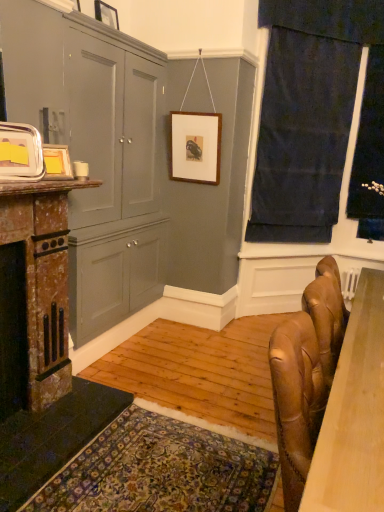
Locate an element on the screen. The height and width of the screenshot is (512, 384). matte yellow picture frame at left, the 2th picture frame in the front-to-back sequence is located at coordinates (57, 162).

Find the location of a particular element. dark blue fabric at upper right is located at coordinates (317, 118).

Measure the distance between dark blue fabric at upper right and camera.

dark blue fabric at upper right is 3.27 meters from camera.

What do you see at coordinates (196, 147) in the screenshot? I see `wooden picture frame at center, the fourth picture frame viewed from the left` at bounding box center [196, 147].

How much space does metallic silver picture frame at upper left, which is counted as the 4th picture frame, starting from the back, occupy vertically?

The height of metallic silver picture frame at upper left, which is counted as the 4th picture frame, starting from the back, is 9.96 inches.

Describe the element at coordinates (34, 294) in the screenshot. Image resolution: width=384 pixels, height=512 pixels. I see `rustic stone fireplace at left` at that location.

The image size is (384, 512). What do you see at coordinates (106, 14) in the screenshot? I see `wooden picture frame at upper center, which is counted as the 1th picture frame, starting from the top` at bounding box center [106, 14].

Locate an element on the screen. This screenshot has width=384, height=512. matte yellow picture frame at left, the second picture frame from the left is located at coordinates (57, 162).

In the image, is rustic stone fireplace at left on the left side or the right side of matte yellow picture frame at left, which ranks as the second picture frame in bottom-to-top order?

Clearly, rustic stone fireplace at left is on the left of matte yellow picture frame at left, which ranks as the second picture frame in bottom-to-top order, in the image.

From the image's perspective, between rustic stone fireplace at left and matte yellow picture frame at left, the third picture frame positioned from the top, who is located below?

rustic stone fireplace at left appears lower in the image.

Which object is thinner, rustic stone fireplace at left or matte yellow picture frame at left, the third picture frame when ordered from back to front?

matte yellow picture frame at left, the third picture frame when ordered from back to front, is thinner.

Does point (44, 328) come farther from viewer compared to point (56, 166)?

Yes.

Can you confirm if black velvet curtain at right is positioned to the left of matte yellow picture frame at left, the third picture frame when ordered from back to front?

No, black velvet curtain at right is not to the left of matte yellow picture frame at left, the third picture frame when ordered from back to front.

Is black velvet curtain at right spatially inside matte yellow picture frame at left, marked as the third picture frame in a right-to-left arrangement, or outside of it?

black velvet curtain at right lies outside matte yellow picture frame at left, marked as the third picture frame in a right-to-left arrangement.

Which object is closer to the camera taking this photo, black velvet curtain at right or matte yellow picture frame at left, the third picture frame when ordered from back to front?

matte yellow picture frame at left, the third picture frame when ordered from back to front.

From the image's perspective, who appears lower, wooden picture frame at upper center, which is counted as the third picture frame, starting from the front, or smooth brown leather table at lower right?

From the image's view, smooth brown leather table at lower right is below.

Is wooden picture frame at upper center, which is counted as the third picture frame, starting from the front, placed right next to smooth brown leather table at lower right?

No, wooden picture frame at upper center, which is counted as the third picture frame, starting from the front, is not with smooth brown leather table at lower right.

Find the location of `table that is under the wooden picture frame at upper center, the second picture frame when ordered from back to front (from a real-world perspective)`. table that is under the wooden picture frame at upper center, the second picture frame when ordered from back to front (from a real-world perspective) is located at coordinates (354, 414).

Based on the photo, how many degrees apart are the facing directions of black velvet curtain at right and smooth brown leather table at lower right?

The facing directions of black velvet curtain at right and smooth brown leather table at lower right are 90.4 degrees apart.

Based on the photo, is black velvet curtain at right in front of or behind smooth brown leather table at lower right in the image?

black velvet curtain at right is behind smooth brown leather table at lower right.

Where is `table on the left of the black velvet curtain at right`? table on the left of the black velvet curtain at right is located at coordinates (354, 414).

Is point (349, 208) less distant than point (343, 430)?

No.

In order to click on curtain lying above the metallic silver picture frame at upper left, which is the 4th picture frame from top to bottom (from the image's perspective) in this screenshot , I will do `click(317, 118)`.

Is dark blue fabric at upper right looking in the opposite direction of metallic silver picture frame at upper left, the 1th picture frame from the front?

That's not correct — dark blue fabric at upper right is not looking away from metallic silver picture frame at upper left, the 1th picture frame from the front.

In the scene shown: Considering the relative sizes of dark blue fabric at upper right and metallic silver picture frame at upper left, marked as the 1th picture frame in a left-to-right arrangement, in the image provided, is dark blue fabric at upper right wider than metallic silver picture frame at upper left, marked as the 1th picture frame in a left-to-right arrangement,?

Correct, the width of dark blue fabric at upper right exceeds that of metallic silver picture frame at upper left, marked as the 1th picture frame in a left-to-right arrangement.

Does point (297, 71) lie behind point (41, 139)?

That is True.

Considering the relative sizes of rustic stone fireplace at left and wooden picture frame at upper center, positioned as the 3th picture frame in left-to-right order, in the image provided, is rustic stone fireplace at left thinner than wooden picture frame at upper center, positioned as the 3th picture frame in left-to-right order,?

In fact, rustic stone fireplace at left might be wider than wooden picture frame at upper center, positioned as the 3th picture frame in left-to-right order.

Is wooden picture frame at upper center, which is counted as the third picture frame, starting from the front, at the back of rustic stone fireplace at left?

rustic stone fireplace at left is not turned away from wooden picture frame at upper center, which is counted as the third picture frame, starting from the front.

From a real-world perspective, is rustic stone fireplace at left above or below wooden picture frame at upper center, marked as the fourth picture frame in a bottom-to-top arrangement?

Clearly, from a real-world perspective, rustic stone fireplace at left is below wooden picture frame at upper center, marked as the fourth picture frame in a bottom-to-top arrangement.

Consider the image. Based on their sizes in the image, would you say rustic stone fireplace at left is bigger or smaller than wooden picture frame at upper center, which is counted as the third picture frame, starting from the front?

Considering their sizes, rustic stone fireplace at left takes up more space than wooden picture frame at upper center, which is counted as the third picture frame, starting from the front.

Between matte yellow picture frame at left, the 2th picture frame in the front-to-back sequence, and dark blue fabric at upper right, which one has smaller width?

With smaller width is matte yellow picture frame at left, the 2th picture frame in the front-to-back sequence.

Is matte yellow picture frame at left, which ranks as the second picture frame in bottom-to-top order, to the left of dark blue fabric at upper right from the viewer's perspective?

Indeed, matte yellow picture frame at left, which ranks as the second picture frame in bottom-to-top order, is positioned on the left side of dark blue fabric at upper right.

Considering the sizes of matte yellow picture frame at left, which ranks as the second picture frame in bottom-to-top order, and dark blue fabric at upper right in the image, is matte yellow picture frame at left, which ranks as the second picture frame in bottom-to-top order, taller or shorter than dark blue fabric at upper right?

matte yellow picture frame at left, which ranks as the second picture frame in bottom-to-top order, is shorter than dark blue fabric at upper right.

Where is `the 3rd picture frame in front of the dark blue fabric at upper right, starting your count from the anchor`? the 3rd picture frame in front of the dark blue fabric at upper right, starting your count from the anchor is located at coordinates (57, 162).

Find the location of `the 1st picture frame behind when counting from the rustic stone fireplace at left`. the 1st picture frame behind when counting from the rustic stone fireplace at left is located at coordinates (57, 162).

Identify the location of picture frame that is the 3rd one below the black velvet curtain at right (from a real-world perspective). This screenshot has height=512, width=384. (57, 162).

Which object lies nearer to the anchor point matte gray cabinet at left, wooden picture frame at upper center, the second picture frame when ordered from back to front, or dark blue fabric at upper right?

Among the two, wooden picture frame at upper center, the second picture frame when ordered from back to front, is located nearer to matte gray cabinet at left.

From the image, which object appears to be nearer to black velvet curtain at right, dark blue fabric at upper right or matte gray cabinet at left?

dark blue fabric at upper right lies closer to black velvet curtain at right than the other object.

From the picture: From the image, which object appears to be farther from rustic stone fireplace at left, metallic silver picture frame at upper left, which appears as the 1th picture frame when ordered from the bottom, or smooth brown leather table at lower right?

smooth brown leather table at lower right is further to rustic stone fireplace at left.

Based on their spatial positions, is metallic silver picture frame at upper left, the 1th picture frame from the front, or matte yellow picture frame at left, marked as the third picture frame in a right-to-left arrangement, closer to smooth brown leather table at lower right?

The object closer to smooth brown leather table at lower right is metallic silver picture frame at upper left, the 1th picture frame from the front.

When comparing their distances from matte gray cabinet at left, does black velvet curtain at right or wooden picture frame at upper center, which is counted as the 1th picture frame, starting from the top, seem closer?

The object closer to matte gray cabinet at left is wooden picture frame at upper center, which is counted as the 1th picture frame, starting from the top.

Estimate the real-world distances between objects in this image. Which object is closer to rustic stone fireplace at left, metallic silver picture frame at upper left, the 1th picture frame from the front, or wooden picture frame at upper center, marked as the fourth picture frame in a bottom-to-top arrangement?

Based on the image, metallic silver picture frame at upper left, the 1th picture frame from the front, appears to be nearer to rustic stone fireplace at left.

Considering their positions, is rustic stone fireplace at left positioned further to black velvet curtain at right than matte yellow picture frame at left, the second picture frame from the left?

Among the two, rustic stone fireplace at left is located further to black velvet curtain at right.

Estimate the real-world distances between objects in this image. Which object is further from wooden picture frame at upper center, positioned as the 3th picture frame in left-to-right order, smooth brown leather table at lower right or rustic stone fireplace at left?

Based on the image, smooth brown leather table at lower right appears to be further to wooden picture frame at upper center, positioned as the 3th picture frame in left-to-right order.

You are a GUI agent. You are given a task and a screenshot of the screen. Output one action in this format:
    pyautogui.click(x=<x>, y=<y>)
    Task: Click on the fireplace between metallic silver picture frame at upper left, which is the 4th picture frame from top to bottom, and wooden picture frame at center, positioned as the 1th picture frame in back-to-front order, in the front-back direction
    
    Given the screenshot: What is the action you would take?
    pyautogui.click(x=34, y=294)

Where is `cabinetry located between smooth brown leather table at lower right and wooden picture frame at center, the fourth picture frame viewed from the left, in the depth direction`? The width and height of the screenshot is (384, 512). cabinetry located between smooth brown leather table at lower right and wooden picture frame at center, the fourth picture frame viewed from the left, in the depth direction is located at coordinates (96, 151).

Identify the location of cabinetry that lies between wooden picture frame at upper center, marked as the fourth picture frame in a bottom-to-top arrangement, and rustic stone fireplace at left from top to bottom. (96, 151).

You are a GUI agent. You are given a task and a screenshot of the screen. Output one action in this format:
    pyautogui.click(x=<x>, y=<y>)
    Task: Click on the picture frame positioned between metallic silver picture frame at upper left, the fourth picture frame viewed from the right, and matte gray cabinet at left from near to far
    
    Given the screenshot: What is the action you would take?
    pyautogui.click(x=57, y=162)